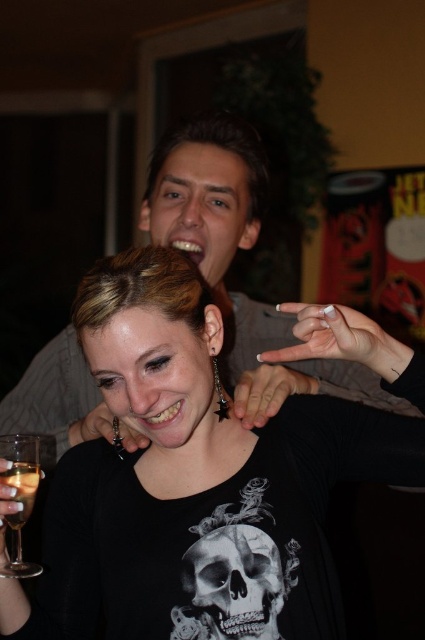
Can you confirm if clear glass wine glass at lower left is wider than translucent glass wine at lower left?

Yes, clear glass wine glass at lower left is wider than translucent glass wine at lower left.

Between point (39, 564) and point (11, 524), which one is positioned in front?

Positioned in front is point (11, 524).

This screenshot has width=425, height=640. Describe the element at coordinates (19, 497) in the screenshot. I see `clear glass wine glass at lower left` at that location.

The width and height of the screenshot is (425, 640). I want to click on clear glass wine glass at lower left, so click(x=19, y=497).

Does point (235, 627) come farther from viewer compared to point (17, 490)?

No, it is not.

Can you confirm if black matte skull at center is positioned to the right of translucent glass wine at lower left?

Yes, black matte skull at center is to the right of translucent glass wine at lower left.

Where is `black matte skull at center`? black matte skull at center is located at coordinates (232, 580).

Locate an element on the screen. black matte skull at center is located at coordinates (232, 580).

Is black matte shirt at center wider than translucent glass wine at lower left?

Yes.

Is black matte shirt at center thinner than translucent glass wine at lower left?

In fact, black matte shirt at center might be wider than translucent glass wine at lower left.

The image size is (425, 640). Identify the location of black matte shirt at center. (195, 483).

Locate an element on the screen. The width and height of the screenshot is (425, 640). black matte shirt at center is located at coordinates (195, 483).